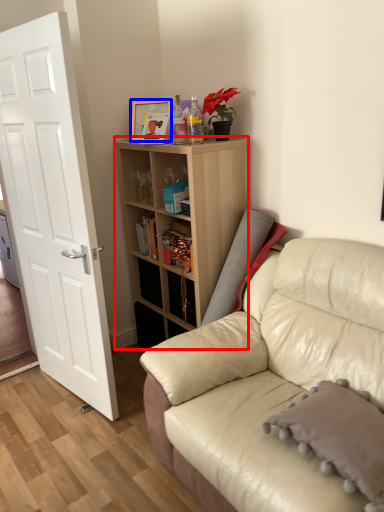
Question: Which point is further to the camera, shelf (highlighted by a red box) or picture frame (highlighted by a blue box)?

Choices:
 (A) shelf
 (B) picture frame

Answer: (B)